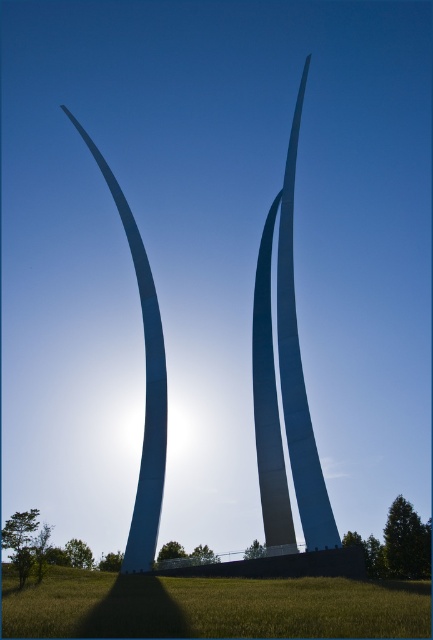
You are standing at the base of the leftmost structure and want to walk directly towards the point marked at point (116, 595). Will you pass by point (267, 522) along the way?

No, because point (116, 595) is in front of point (267, 522), so walking towards the first point would not require passing the second point.